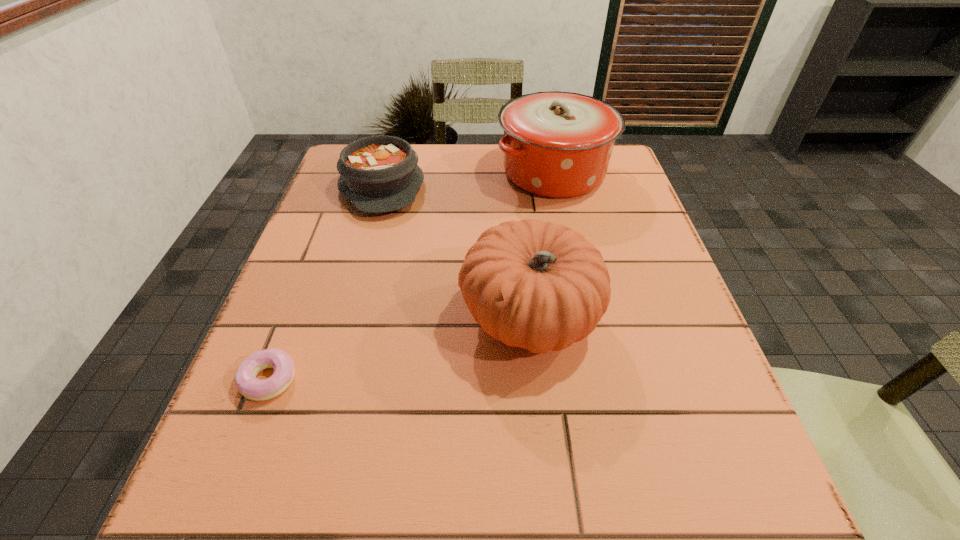
You are a GUI agent. You are given a task and a screenshot of the screen. Output one action in this format:
    pyautogui.click(x=<x>, y=<y>)
    Task: Click on the doughnut that is at the left edge
    This screenshot has height=540, width=960.
    Given the screenshot: What is the action you would take?
    pyautogui.click(x=247, y=384)

Identify the location of object that is positioned at the right edge. The width and height of the screenshot is (960, 540). (556, 144).

At what (x,y) coordinates should I click in order to perform the action: click on object that is at the far left corner. Please return your answer as a coordinate pair (x, y). This screenshot has width=960, height=540. Looking at the image, I should click on (378, 174).

Find the location of a particular element. The width and height of the screenshot is (960, 540). object situated at the far right corner is located at coordinates (556, 144).

What are the coordinates of `vacant area at the far edge` in the screenshot? It's located at pyautogui.click(x=463, y=149).

I want to click on vacant area at the near edge, so click(429, 536).

Image resolution: width=960 pixels, height=540 pixels. Identify the location of vacant area at the left edge. (229, 452).

What are the coordinates of `free space at the right edge of the desktop` in the screenshot? It's located at (619, 357).

The image size is (960, 540). Find the location of `empty space that is in between the shortest object and the pumpkin`. empty space that is in between the shortest object and the pumpkin is located at coordinates (399, 349).

Locate an element on the screen. The width and height of the screenshot is (960, 540). blank region between the shortest object and the left casserole is located at coordinates (325, 283).